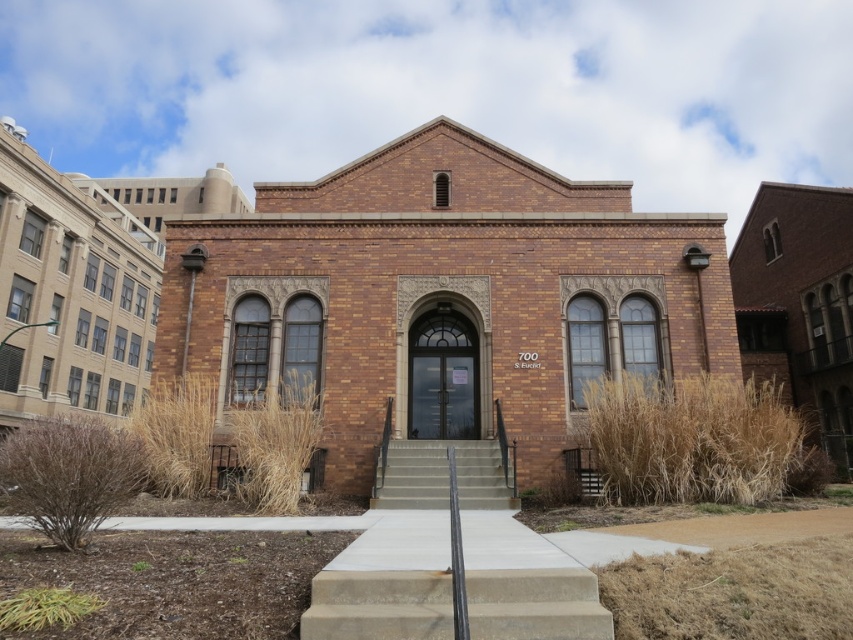
In the scene shown: Does brown brick church at center have a smaller size compared to concrete/steps at center?

No, brown brick church at center is not smaller than concrete/steps at center.

Image resolution: width=853 pixels, height=640 pixels. In order to click on brown brick church at center in this screenshot , I will do `click(70, 292)`.

Is brown brick chapel at center positioned behind brown brick church at center?

No, brown brick chapel at center is in front of brown brick church at center.

Based on the photo, measure the distance between brown brick chapel at center and camera.

brown brick chapel at center and camera are 11.96 meters apart from each other.

Locate an element on the screen. brown brick chapel at center is located at coordinates (442, 298).

Is concrete/steps at center taller than concrete stairs at center?

No.

Who is higher up, concrete/steps at center or concrete stairs at center?

concrete/steps at center is above.

Who is more forward, (416, 621) or (474, 461)?

Point (416, 621)

At what (x,y) coordinates should I click in order to perform the action: click on concrete/steps at center. Please return your answer as a coordinate pair (x, y). Image resolution: width=853 pixels, height=640 pixels. Looking at the image, I should click on (378, 605).